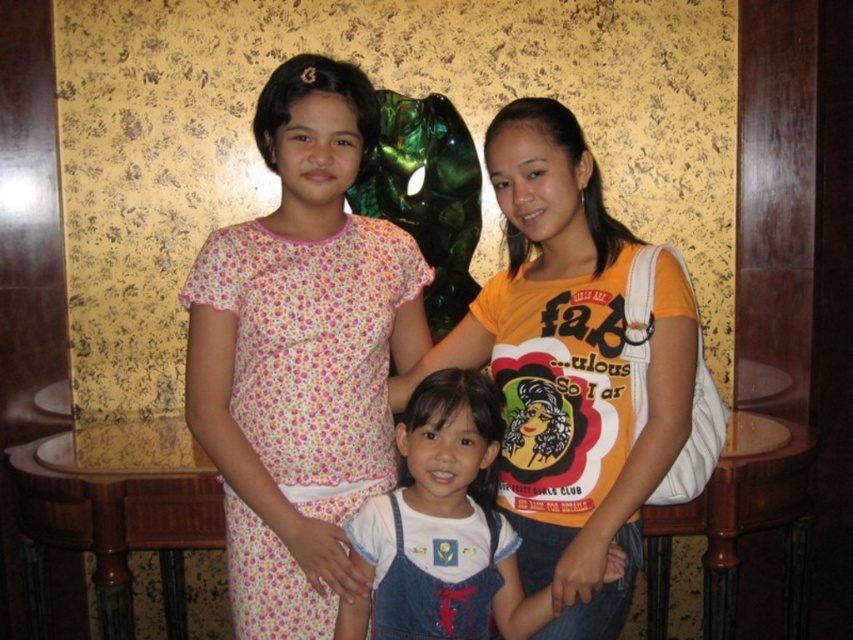
You are a photographer setting up a photo shoot in a cozy indoor space with warm lighting. You need to arrange two outfits for a photoshoot against a golden wall. The outfits are the floral cotton dress at center and the white denim overalls at center. Based on the scene description, which outfit is taller?

The floral cotton dress at center is taller than the white denim overalls at center according to the description.

You are a photographer setting up for a group photo. You have two subjects wearing the floral cotton dress at center and white denim overalls at center. Which clothing item is bigger in size?

The floral cotton dress at center is larger in size than the white denim overalls at center.